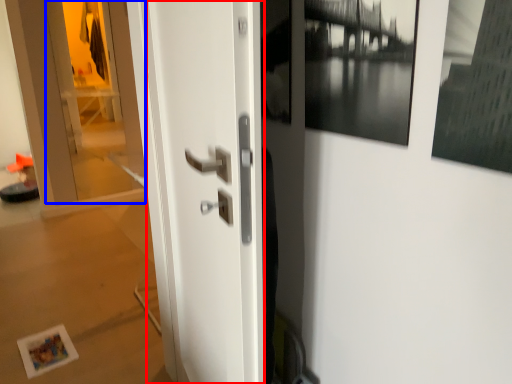
Question: Among these objects, which one is nearest to the camera, door (highlighted by a red box) or glass door (highlighted by a blue box)?

Choices:
 (A) door
 (B) glass door

Answer: (A)